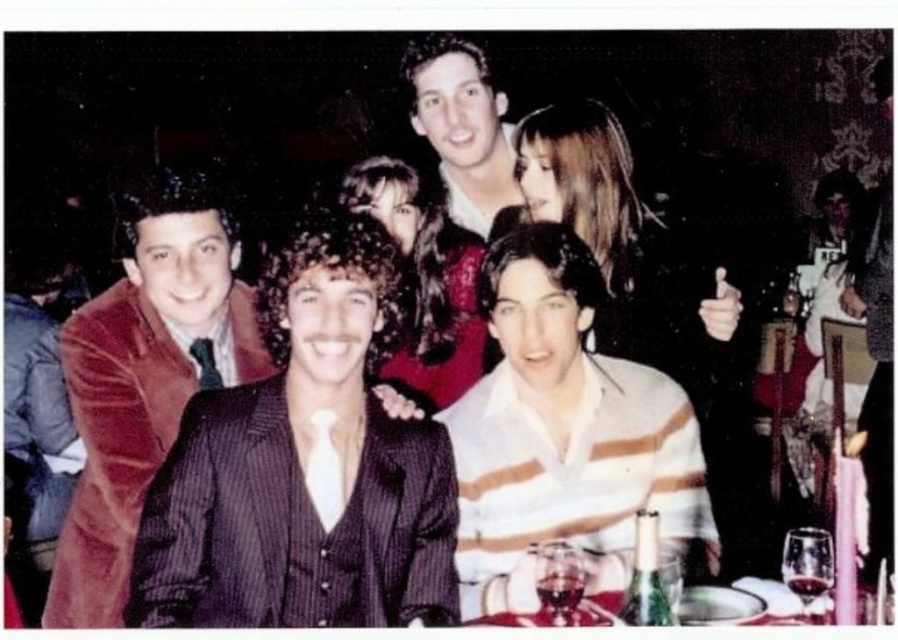
In the scene shown: You are a photographer at the event and want to capture a photo of the shiny white shirt at upper center and the shiny silver tray at lower center. To ensure both are in frame, should you adjust your camera to focus on the left side or the right side of the scene?

The shiny white shirt at upper center is positioned on the left side of the shiny silver tray at lower center, so you should focus on the left side to include both objects in the frame.

You are at the lively social gathering and want to move from the point closer to you to the point farther away. Which path would you take between the two points, point [102,410] and point [887,593]?

→ The path from point [102,410] to point [887,593] would involve moving away from the viewer since point [102,410] is closer to you and point [887,593] is farther away.

You are a photographer standing at the back of the room. You want to take a photo of the velvet red suit at left and the shiny silver tray at lower center. Which object will appear larger in your photo?

The velvet red suit at left will appear larger in the photo because it is closer to the photographer than the shiny silver tray at lower center.